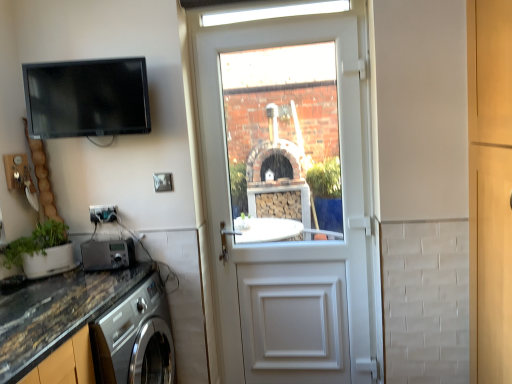
Question: Is matte black electric outlet at lower left next to white plastic door at center and touching it?

Choices:
 (A) no
 (B) yes

Answer: (A)

Question: Is matte black electric outlet at lower left facing towards white plastic door at center?

Choices:
 (A) yes
 (B) no

Answer: (B)

Question: Is matte black electric outlet at lower left far away from white plastic door at center?

Choices:
 (A) yes
 (B) no

Answer: (B)

Question: Would you say matte black electric outlet at lower left contains white plastic door at center?

Choices:
 (A) yes
 (B) no

Answer: (B)

Question: Is matte black electric outlet at lower left shorter than white plastic door at center?

Choices:
 (A) yes
 (B) no

Answer: (A)

Question: From a real-world perspective, is matte black electric outlet at lower left on white plastic door at center?

Choices:
 (A) no
 (B) yes

Answer: (A)

Question: Considering the relative positions of green matte plant at lower left and marble-like granite countertop at lower left in the image provided, is green matte plant at lower left to the right of marble-like granite countertop at lower left from the viewer's perspective?

Choices:
 (A) yes
 (B) no

Answer: (B)

Question: Is green matte plant at lower left thinner than marble-like granite countertop at lower left?

Choices:
 (A) yes
 (B) no

Answer: (A)

Question: Is green matte plant at lower left oriented away from marble-like granite countertop at lower left?

Choices:
 (A) yes
 (B) no

Answer: (B)

Question: Is there a large distance between green matte plant at lower left and marble-like granite countertop at lower left?

Choices:
 (A) yes
 (B) no

Answer: (B)

Question: Is green matte plant at lower left beside marble-like granite countertop at lower left?

Choices:
 (A) no
 (B) yes

Answer: (A)

Question: Does green matte plant at lower left lie behind marble-like granite countertop at lower left?

Choices:
 (A) no
 (B) yes

Answer: (B)

Question: From a real-world perspective, is green matte plant at lower left on top of metallic silver radio at lower left, marked as the second appliance in a top-to-bottom arrangement?

Choices:
 (A) no
 (B) yes

Answer: (B)